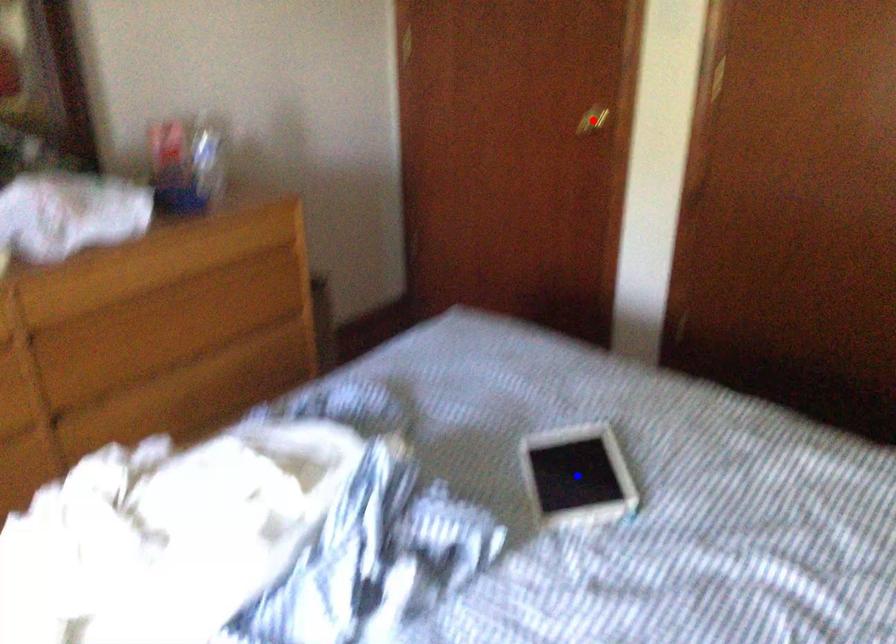
Question: Which of the two points in the image is closer to the camera?

Choices:
 (A) Blue point is closer.
 (B) Red point is closer.

Answer: (A)